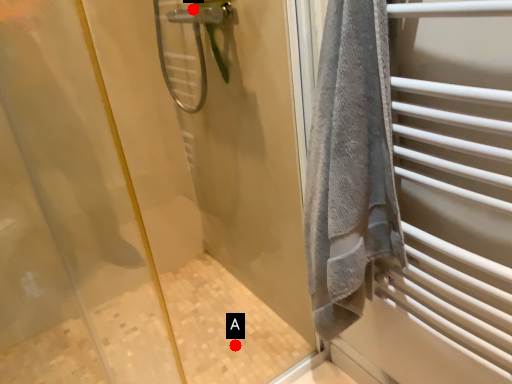
Question: Two points are circled on the image, labeled by A and B beside each circle. Which point is closer to the camera?

Choices:
 (A) A is closer
 (B) B is closer

Answer: (B)